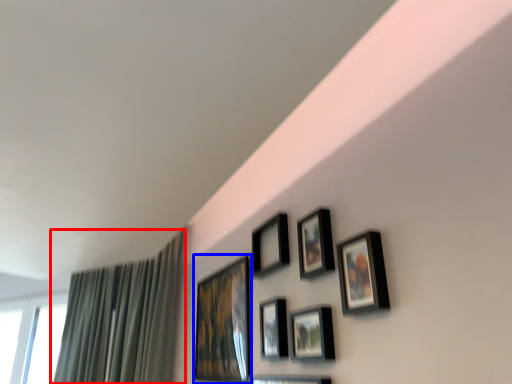
Question: Which point is further to the camera, curtain (highlighted by a red box) or picture frame (highlighted by a blue box)?

Choices:
 (A) curtain
 (B) picture frame

Answer: (A)